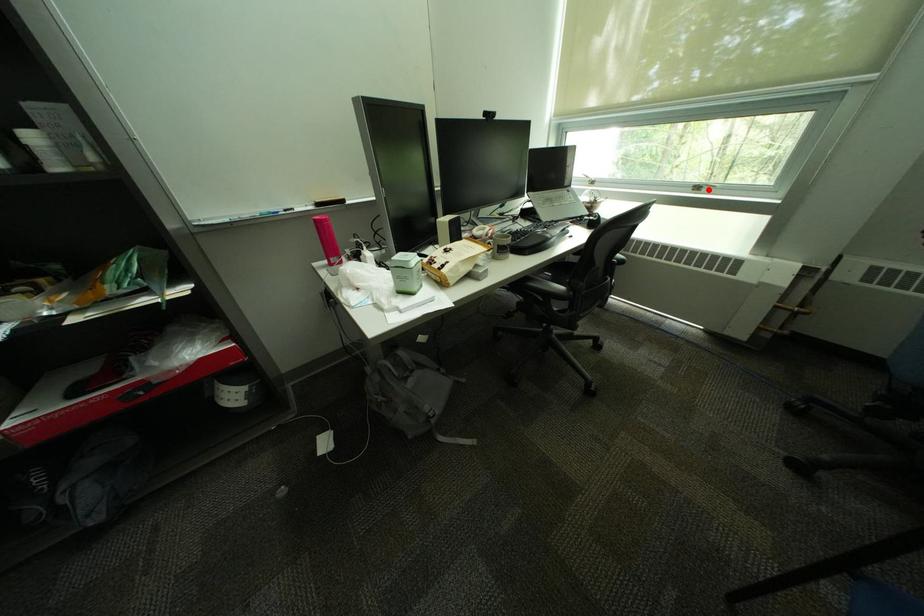
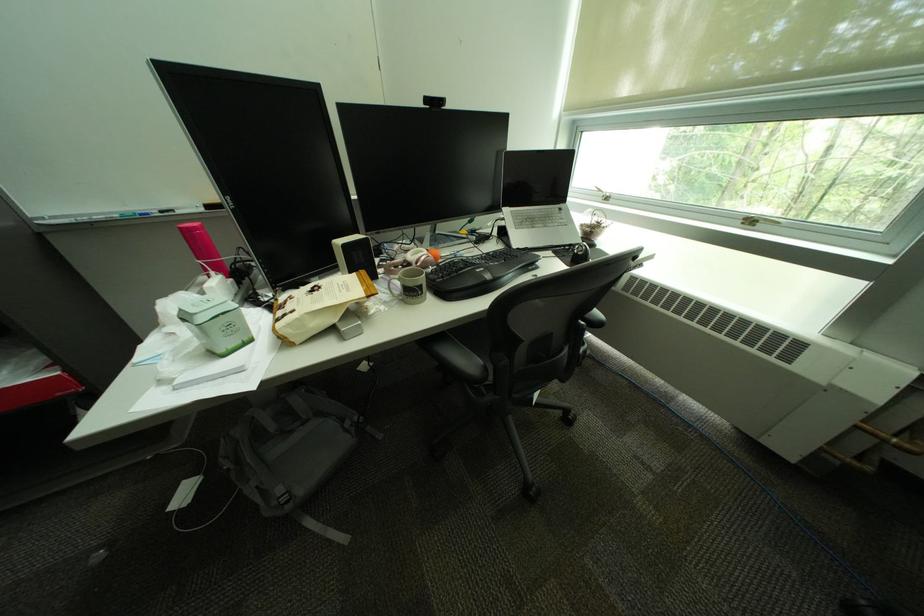
The point at the highlighted location is marked in the first image. Where is the corresponding point in the second image?

(761, 224)